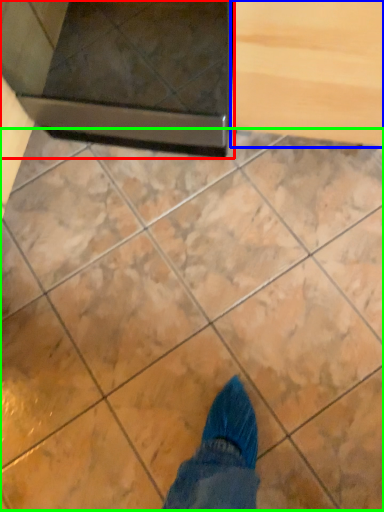
Question: Estimate the real-world distances between objects in this image. Which object is farther from appliance (highlighted by a red box), drawer (highlighted by a blue box) or marble (highlighted by a green box)?

Choices:
 (A) drawer
 (B) marble

Answer: (B)